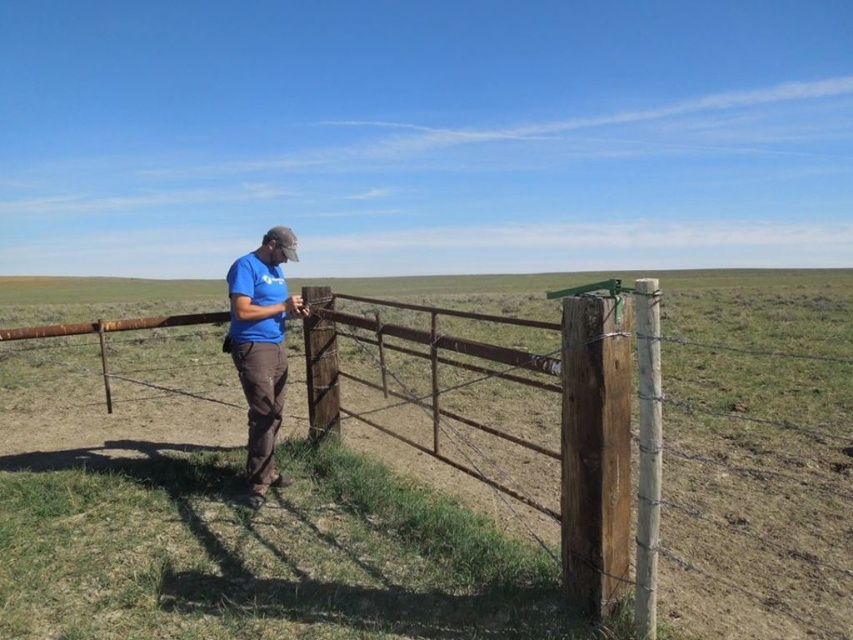
Question: Is rusty metal fence at center thinner than blue cotton shirt at center?

Choices:
 (A) no
 (B) yes

Answer: (A)

Question: Does rusty metal fence at center have a smaller size compared to blue cotton shirt at center?

Choices:
 (A) no
 (B) yes

Answer: (A)

Question: In this image, where is rusty metal fence at center located relative to blue cotton shirt at center?

Choices:
 (A) left
 (B) right

Answer: (B)

Question: Which of the following is the farthest from the observer?

Choices:
 (A) (773, 358)
 (B) (273, 397)

Answer: (A)

Question: Which of the following is the closest to the observer?

Choices:
 (A) rusty metal fence at center
 (B) blue cotton shirt at center

Answer: (A)